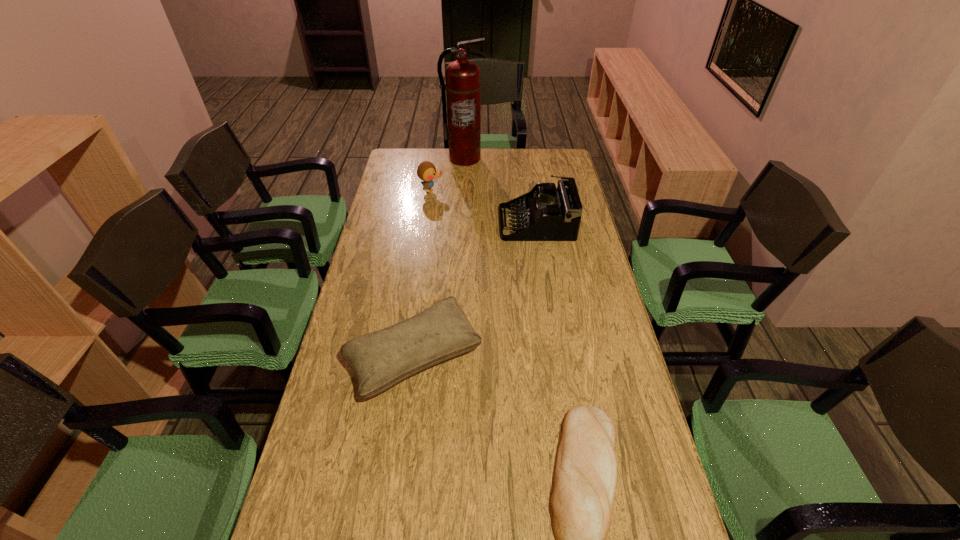
This screenshot has height=540, width=960. What are the coordinates of `free spot that satisfies the following two spatial constraints: 1. on the front-facing side of the cushion; 2. on the left side of the second farthest object` in the screenshot? It's located at (407, 356).

At what (x,y) coordinates should I click in order to perform the action: click on vacant point that satisfies the following two spatial constraints: 1. on the front-facing side of the second farthest object; 2. on the back side of the fourth farthest object. Please return your answer as a coordinate pair (x, y). Looking at the image, I should click on (407, 356).